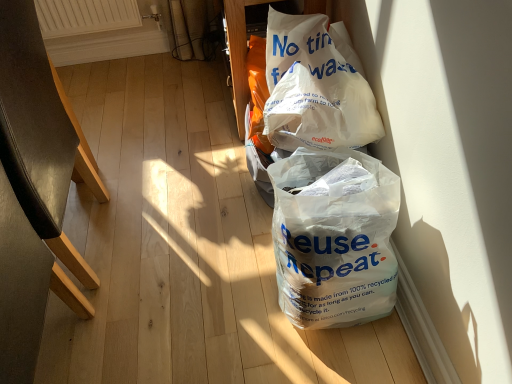
Question: Is white textured radiator at upper left at the left side of white paper bag at upper right, the 1th plastic bag in the top-to-bottom sequence?

Choices:
 (A) no
 (B) yes

Answer: (B)

Question: Is white textured radiator at upper left smaller than white paper bag at upper right, the 1th plastic bag in the top-to-bottom sequence?

Choices:
 (A) no
 (B) yes

Answer: (B)

Question: Considering the relative positions of white textured radiator at upper left and white paper bag at upper right, the 1th plastic bag in the top-to-bottom sequence, in the image provided, is white textured radiator at upper left in front of white paper bag at upper right, the 1th plastic bag in the top-to-bottom sequence,?

Choices:
 (A) yes
 (B) no

Answer: (B)

Question: From a real-world perspective, is white textured radiator at upper left below white paper bag at upper right, the 1th plastic bag in the top-to-bottom sequence?

Choices:
 (A) no
 (B) yes

Answer: (B)

Question: Can you confirm if white textured radiator at upper left is thinner than white paper bag at upper right, acting as the second plastic bag starting from the bottom?

Choices:
 (A) no
 (B) yes

Answer: (B)

Question: Does white textured radiator at upper left touch white paper bag at upper right, the 1th plastic bag in the top-to-bottom sequence?

Choices:
 (A) no
 (B) yes

Answer: (A)

Question: Is black leather chair at left in contact with white paper bag at upper right, the 1th plastic bag in the top-to-bottom sequence?

Choices:
 (A) yes
 (B) no

Answer: (B)

Question: From a real-world perspective, is black leather chair at left beneath white paper bag at upper right, acting as the second plastic bag starting from the bottom?

Choices:
 (A) no
 (B) yes

Answer: (B)

Question: Does black leather chair at left come in front of white paper bag at upper right, the 1th plastic bag in the top-to-bottom sequence?

Choices:
 (A) no
 (B) yes

Answer: (B)

Question: Is black leather chair at left oriented away from white paper bag at upper right, acting as the second plastic bag starting from the bottom?

Choices:
 (A) yes
 (B) no

Answer: (A)

Question: Would you say white paper bag at upper right, acting as the second plastic bag starting from the bottom, is part of black leather chair at left's contents?

Choices:
 (A) no
 (B) yes

Answer: (A)

Question: Considering the relative positions of black leather chair at left and white paper bag at upper right, the 1th plastic bag in the top-to-bottom sequence, in the image provided, is black leather chair at left to the left of white paper bag at upper right, the 1th plastic bag in the top-to-bottom sequence, from the viewer's perspective?

Choices:
 (A) yes
 (B) no

Answer: (A)

Question: Is white paper bag at upper right, acting as the second plastic bag starting from the bottom, located outside black leather chair at left?

Choices:
 (A) yes
 (B) no

Answer: (A)